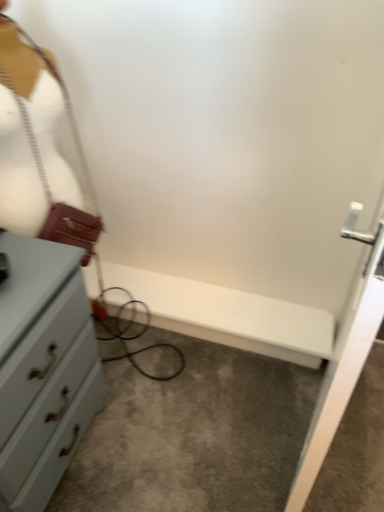
The width and height of the screenshot is (384, 512). What are the coordinates of `black cable at left` in the screenshot? It's located at (52, 179).

What do you see at coordinates (52, 179) in the screenshot? The height and width of the screenshot is (512, 384). I see `black cable at left` at bounding box center [52, 179].

Image resolution: width=384 pixels, height=512 pixels. What do you see at coordinates (40, 149) in the screenshot?
I see `leather-like white mannequin at left` at bounding box center [40, 149].

Locate an element on the screen. leather-like white mannequin at left is located at coordinates (40, 149).

Locate an element on the screen. The height and width of the screenshot is (512, 384). black cable at left is located at coordinates (52, 179).

Visually, is black cable at left positioned to the left or to the right of leather-like white mannequin at left?

Based on their positions, black cable at left is located to the left of leather-like white mannequin at left.

Is black cable at left closer to the viewer compared to leather-like white mannequin at left?

Yes, it is in front of leather-like white mannequin at left.

Does point (13, 170) come farther from viewer compared to point (88, 205)?

No, it is in front of (88, 205).

Looking at this image, from the image's perspective, which one is positioned higher, black cable at left or leather-like white mannequin at left?

leather-like white mannequin at left appears higher in the image.

From a real-world perspective, which is physically above, black cable at left or leather-like white mannequin at left?

leather-like white mannequin at left.

Considering the relative sizes of black cable at left and leather-like white mannequin at left in the image provided, is black cable at left thinner than leather-like white mannequin at left?

No.

Consider the image. Which of these two, black cable at left or leather-like white mannequin at left, stands shorter?

leather-like white mannequin at left is shorter.

Based on their sizes in the image, would you say black cable at left is bigger or smaller than leather-like white mannequin at left?

In the image, black cable at left appears to be larger than leather-like white mannequin at left.

Is black cable at left outside of leather-like white mannequin at left?

black cable at left is positioned outside leather-like white mannequin at left.

Is black cable at left positioned far away from leather-like white mannequin at left?

No, black cable at left is in close proximity to leather-like white mannequin at left.

Is black cable at left looking in the opposite direction of leather-like white mannequin at left?

Yes, black cable at left's orientation is away from leather-like white mannequin at left.

How different are the orientations of black cable at left and leather-like white mannequin at left in degrees?

They differ by 4.86 degrees in their facing directions.

Locate an element on the screen. mannequin behind the black cable at left is located at coordinates (40, 149).

Can you confirm if leather-like white mannequin at left is positioned to the right of black cable at left?

Yes, leather-like white mannequin at left is to the right of black cable at left.

Which object is closer to the camera, leather-like white mannequin at left or black cable at left?

black cable at left.

Which is nearer, (9, 198) or (86, 224)?

Point (9, 198).

From the image's perspective, which one is positioned lower, leather-like white mannequin at left or black cable at left?

black cable at left.

From a real-world perspective, which object rests below the other?

In real-world perspective, black cable at left is lower.

Considering the sizes of objects leather-like white mannequin at left and black cable at left in the image provided, who is thinner, leather-like white mannequin at left or black cable at left?

Thinner between the two is leather-like white mannequin at left.

Considering the sizes of leather-like white mannequin at left and black cable at left in the image, is leather-like white mannequin at left taller or shorter than black cable at left?

In the image, leather-like white mannequin at left appears to be shorter than black cable at left.

Between leather-like white mannequin at left and black cable at left, which one has larger size?

Bigger between the two is black cable at left.

Would you say leather-like white mannequin at left is inside or outside black cable at left?

leather-like white mannequin at left is enclosed within black cable at left.

Is leather-like white mannequin at left directly adjacent to black cable at left?

Yes.

Is leather-like white mannequin at left positioned with its back to black cable at left?

Yes, leather-like white mannequin at left is positioned with its back facing black cable at left.

Find the location of a particular element. This screenshot has width=384, height=512. mannequin behind the black cable at left is located at coordinates (40, 149).

Locate an element on the screen. The width and height of the screenshot is (384, 512). mannequin behind the black cable at left is located at coordinates pyautogui.click(x=40, y=149).

Locate an element on the screen. The image size is (384, 512). wire to the left of leather-like white mannequin at left is located at coordinates (52, 179).